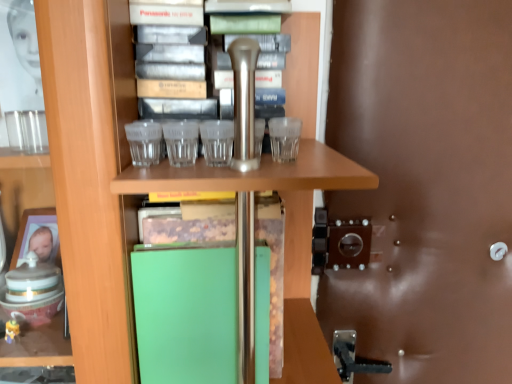
Question: From a real-world perspective, is brown leather door at right over green matte folder at center?

Choices:
 (A) yes
 (B) no

Answer: (A)

Question: Is brown leather door at right oriented away from green matte folder at center?

Choices:
 (A) no
 (B) yes

Answer: (A)

Question: Does brown leather door at right turn towards green matte folder at center?

Choices:
 (A) yes
 (B) no

Answer: (B)

Question: Is brown leather door at right bigger than green matte folder at center?

Choices:
 (A) no
 (B) yes

Answer: (B)

Question: Is brown leather door at right in front of green matte folder at center?

Choices:
 (A) no
 (B) yes

Answer: (A)

Question: Considering the relative sizes of brown leather door at right and green matte folder at center in the image provided, is brown leather door at right shorter than green matte folder at center?

Choices:
 (A) yes
 (B) no

Answer: (B)

Question: Does green matte folder at center have a larger size compared to brown leather door at right?

Choices:
 (A) no
 (B) yes

Answer: (A)

Question: From the image's perspective, is green matte folder at center under brown leather door at right?

Choices:
 (A) no
 (B) yes

Answer: (B)

Question: From a real-world perspective, is green matte folder at center on brown leather door at right?

Choices:
 (A) yes
 (B) no

Answer: (B)

Question: Is green matte folder at center thinner than brown leather door at right?

Choices:
 (A) yes
 (B) no

Answer: (B)

Question: Is the depth of green matte folder at center less than that of brown leather door at right?

Choices:
 (A) no
 (B) yes

Answer: (B)

Question: Does green matte folder at center have a smaller size compared to brown leather door at right?

Choices:
 (A) yes
 (B) no

Answer: (A)

Question: In the image, is brown leather door at right on the left side or the right side of green matte folder at center?

Choices:
 (A) right
 (B) left

Answer: (A)